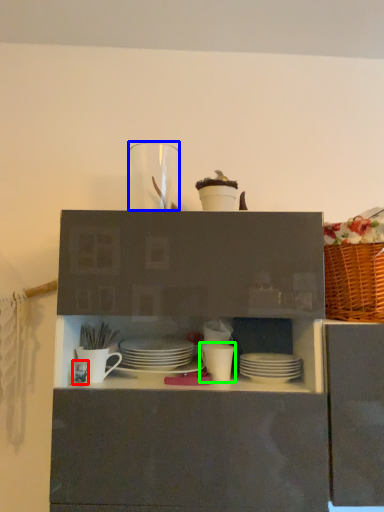
Question: Which object is the farthest from tableware (highlighted by a red box)? Choose among these: tableware (highlighted by a blue box) or tableware (highlighted by a green box).

Choices:
 (A) tableware
 (B) tableware

Answer: (A)